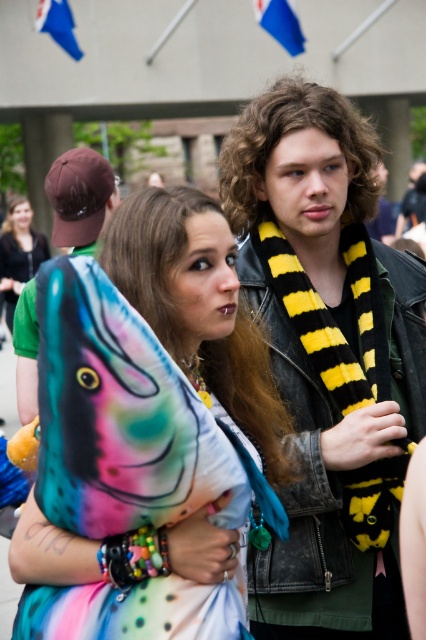
Question: Which of the following is the closest to the observer?

Choices:
 (A) (5, 221)
 (B) (195, 458)
 (C) (252, 108)
 (D) (256, 200)

Answer: (B)

Question: Which of the following is the closest to the observer?

Choices:
 (A) (20, 278)
 (B) (325, 570)
 (C) (334, 403)

Answer: (B)

Question: Does multicolored plush fish at center have a lesser width compared to matte green t-shirt at left?

Choices:
 (A) no
 (B) yes

Answer: (A)

Question: Observing the image, what is the correct spatial positioning of shiny yellow scarf at center in reference to matte green t-shirt at left?

Choices:
 (A) left
 (B) right

Answer: (B)

Question: Which of the following is the farthest from the observer?

Choices:
 (A) (328, 113)
 (B) (25, 291)

Answer: (B)

Question: Can you confirm if black knitted scarf at center is positioned to the right of shiny yellow scarf at center?

Choices:
 (A) no
 (B) yes

Answer: (B)